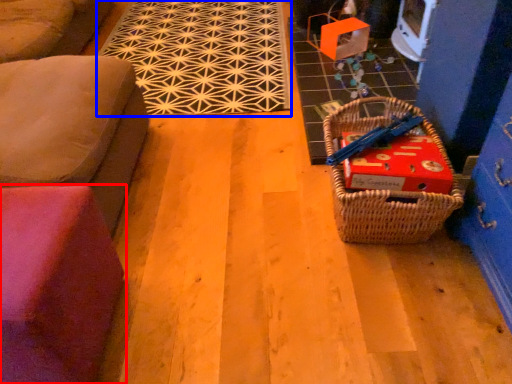
Question: Which object is further to the camera taking this photo, furniture (highlighted by a red box) or mat (highlighted by a blue box)?

Choices:
 (A) furniture
 (B) mat

Answer: (B)